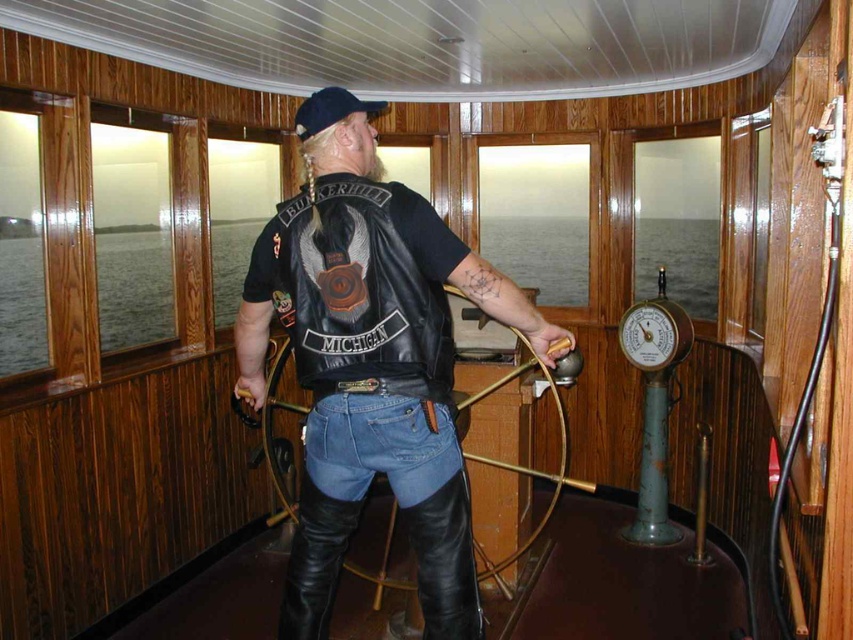
Based on the scene described, which clothing item, the leather jacket at center or the denim jeans at center, would require more space to store in a closet?

The leather jacket at center is bigger than the denim jeans at center, so it would require more space to store in a closet.

You are a photographer trying to capture the person in the ship wheelhouse. You want to ensure both the leather jacket at center and denim jeans at center are visible in the frame. Based on their positions, which clothing item will appear closer to the top of the photo?

The leather jacket at center is located above denim jeans at center, so it will appear closer to the top of the photo.